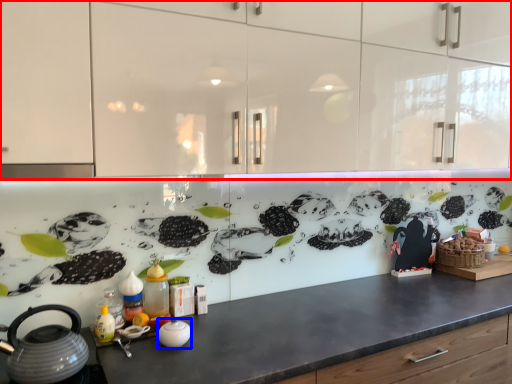
Question: Which object is further to the camera taking this photo, cabinetry (highlighted by a red box) or appliance (highlighted by a blue box)?

Choices:
 (A) cabinetry
 (B) appliance

Answer: (B)